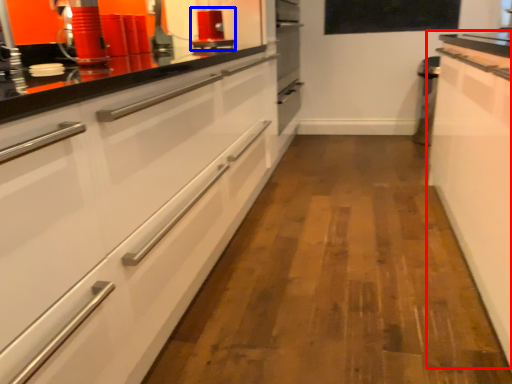
Question: Among these objects, which one is farthest to the camera, cabinetry (highlighted by a red box) or appliance (highlighted by a blue box)?

Choices:
 (A) cabinetry
 (B) appliance

Answer: (B)